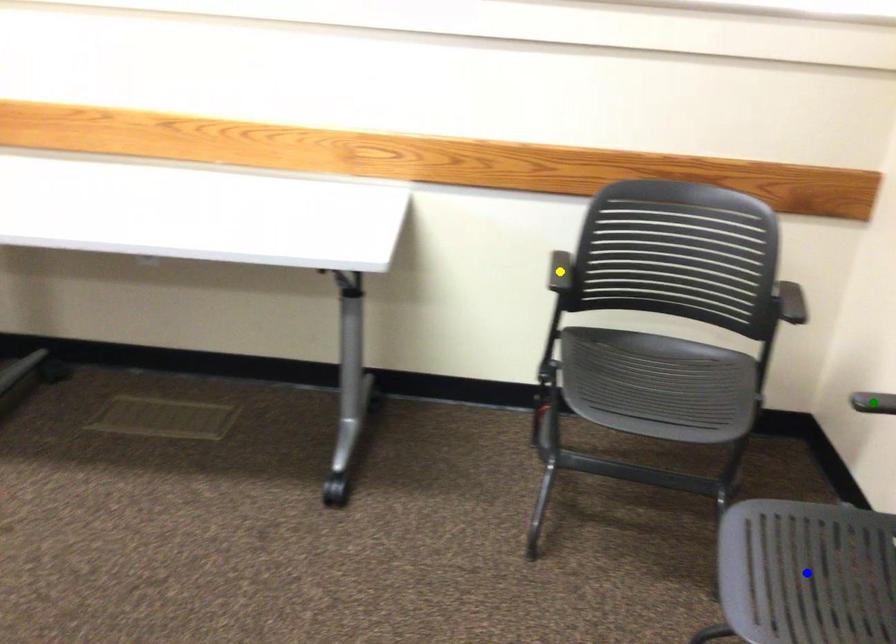
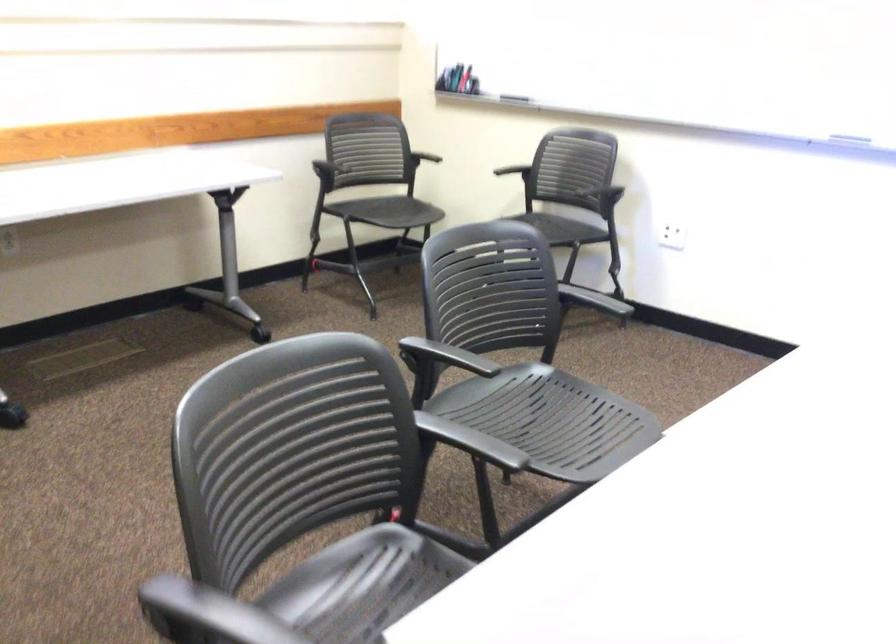
I am providing you with two images of the same scene from different viewpoints. Three points are marked in image1. Which point corresponds to a part or object that is occluded in image2?In image1, three points are marked. Which of them correspond to a part or object that is occluded in image2?Among the three points shown in image1, which one corresponds to a part or object that is no longer visible due to occlusion in image2?

Invisible in image2: blue point.